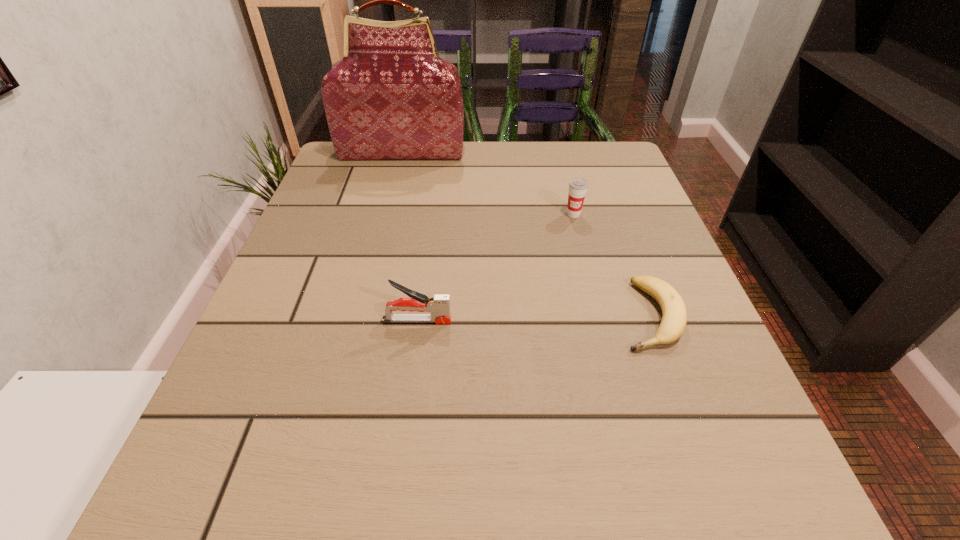
The image size is (960, 540). I want to click on the farthest object, so click(391, 96).

The height and width of the screenshot is (540, 960). In order to click on handbag in this screenshot , I will do `click(391, 96)`.

Identify the location of the second object from right to left. (578, 187).

At what (x,y) coordinates should I click in order to perform the action: click on cup. Please return your answer as a coordinate pair (x, y). The image size is (960, 540). Looking at the image, I should click on [x=578, y=187].

The width and height of the screenshot is (960, 540). I want to click on stapler, so (x=438, y=305).

What are the coordinates of `banana` in the screenshot? It's located at (674, 319).

In order to click on the rightmost object in this screenshot , I will do `click(674, 319)`.

Where is `free spot located 0.130m on the front-facing side of the handbag`? This screenshot has height=540, width=960. free spot located 0.130m on the front-facing side of the handbag is located at coordinates (393, 190).

Where is `free region located on the side of the cup with the logo`? Image resolution: width=960 pixels, height=540 pixels. free region located on the side of the cup with the logo is located at coordinates (616, 382).

The height and width of the screenshot is (540, 960). Identify the location of vacant area situated 0.130m on the handle side of the stapler. (529, 320).